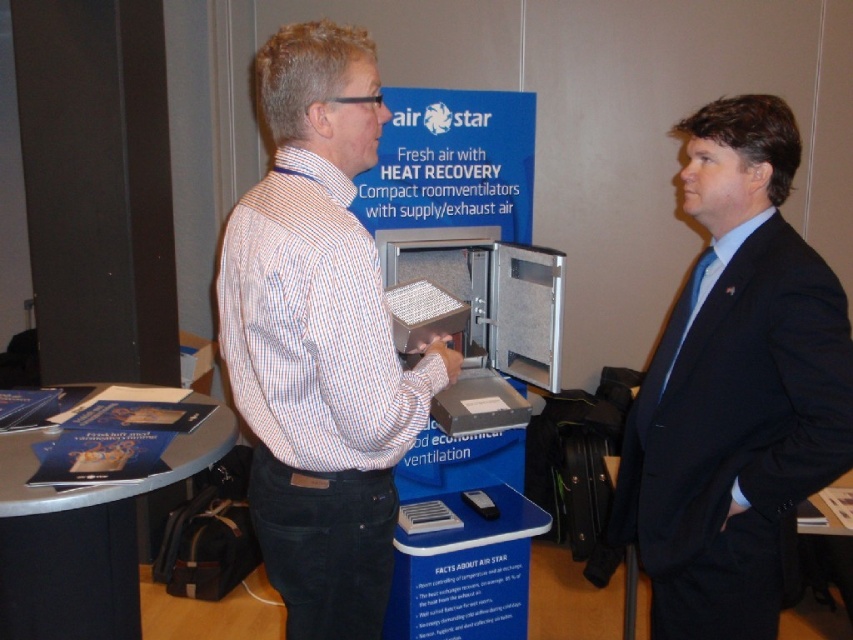
Does point (335, 376) lie behind point (695, 360)?

No, it is not.

Who is shorter, white striped shirt at center or dark blue suit at right?

dark blue suit at right

Find the location of a particular element. The width and height of the screenshot is (853, 640). white striped shirt at center is located at coordinates (318, 339).

In the scene shown: Who is shorter, white striped shirt at center or blue paper at lower left?

Standing shorter between the two is blue paper at lower left.

Does white striped shirt at center have a greater height compared to blue paper at lower left?

Correct, white striped shirt at center is much taller as blue paper at lower left.

Does point (300, 508) come closer to viewer compared to point (62, 561)?

Yes.

Identify the location of white striped shirt at center. (318, 339).

Which is more to the left, dark blue suit at right or blue paper at lower left?

From the viewer's perspective, blue paper at lower left appears more on the left side.

Consider the image. Is dark blue suit at right shorter than blue paper at lower left?

No.

Find the location of a particular element. The height and width of the screenshot is (640, 853). dark blue suit at right is located at coordinates (735, 388).

The width and height of the screenshot is (853, 640). What are the coordinates of `dark blue suit at right` in the screenshot? It's located at (735, 388).